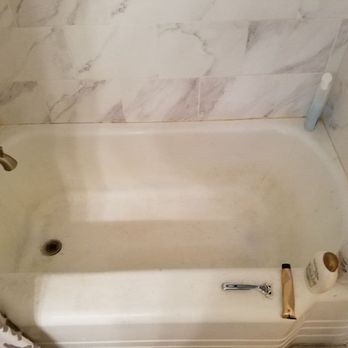
The image size is (348, 348). I want to click on bottle, so pyautogui.click(x=328, y=280).